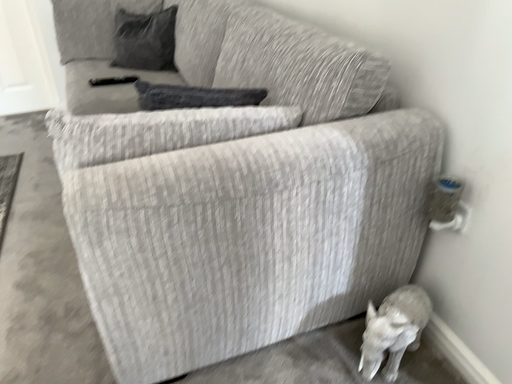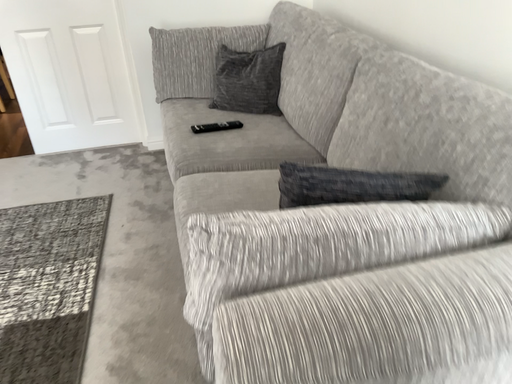
Question: Which way did the camera rotate in the video?

Choices:
 (A) rotated right
 (B) rotated left

Answer: (B)